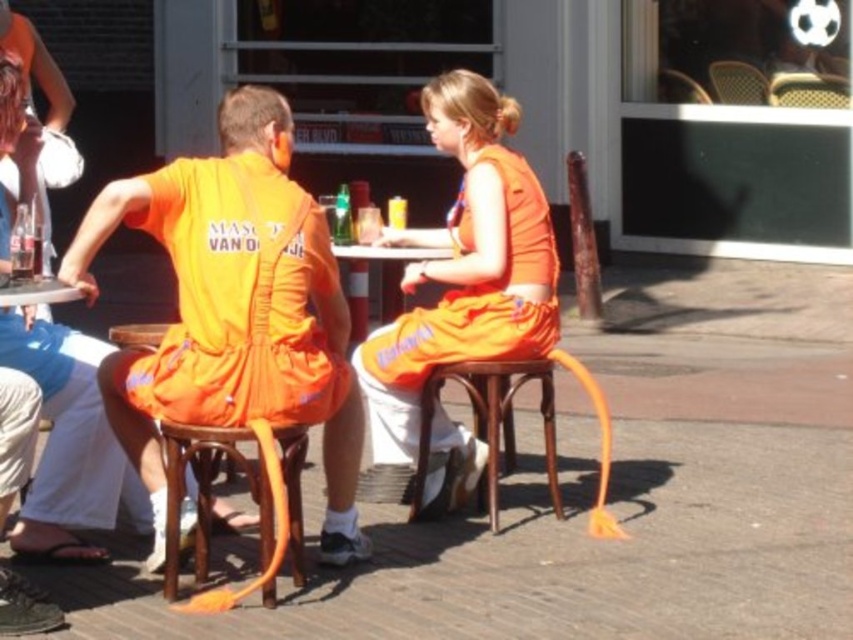
Between point (473, 156) and point (16, 252), which one is positioned behind?

The point (473, 156) is more distant.

Measure the distance from orange fabric dress at center to matte glass bottle at left.

orange fabric dress at center is 2.45 meters away from matte glass bottle at left.

What do you see at coordinates (461, 275) in the screenshot? The image size is (853, 640). I see `orange fabric dress at center` at bounding box center [461, 275].

At what (x,y) coordinates should I click in order to perform the action: click on orange fabric dress at center. Please return your answer as a coordinate pair (x, y). The image size is (853, 640). Looking at the image, I should click on (461, 275).

Who is taller, wooden textured chair at upper right or wooden chair at upper center?

Standing taller between the two is wooden textured chair at upper right.

Based on the photo, does wooden textured chair at upper right have a greater width compared to wooden chair at upper center?

Indeed, wooden textured chair at upper right has a greater width compared to wooden chair at upper center.

Who is more forward, (784, 76) or (674, 99)?

Point (784, 76) is in front.

This screenshot has height=640, width=853. I want to click on wooden textured chair at upper right, so click(808, 90).

Which is more to the left, wooden textured chair at upper right or matte glass bottle at left?

From the viewer's perspective, matte glass bottle at left appears more on the left side.

Can you confirm if wooden textured chair at upper right is shorter than matte glass bottle at left?

No.

I want to click on wooden textured chair at upper right, so click(x=808, y=90).

Locate an element on the screen. The width and height of the screenshot is (853, 640). wooden textured chair at upper right is located at coordinates (808, 90).